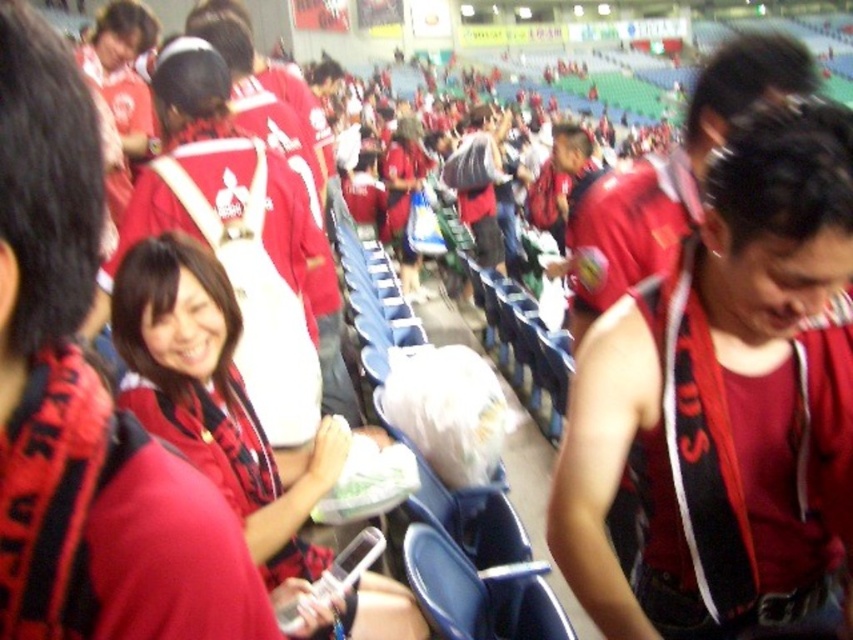
You are a photographer standing at the front row of the stadium. You want to take a photo of both the matte red shirt at center and the matte red jersey at center. Which one will appear larger in your photo?

The matte red shirt at center will appear larger in the photo because it is closer to the viewer than the matte red jersey at center.